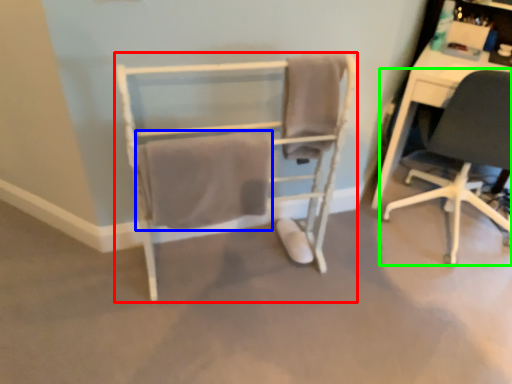
Question: Which is farther away from chair (highlighted by a red box)? bath towel (highlighted by a blue box) or chair (highlighted by a green box)?

Choices:
 (A) bath towel
 (B) chair

Answer: (B)